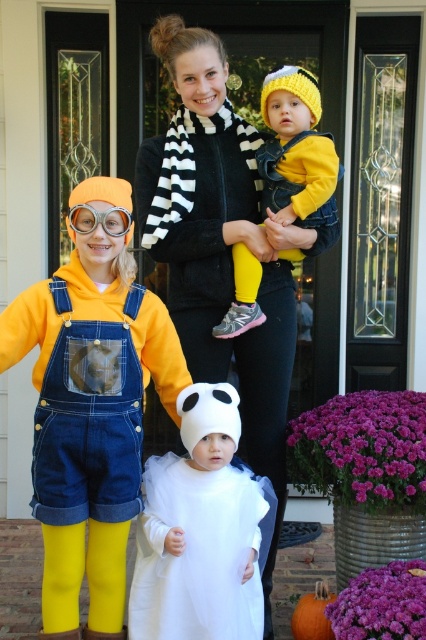
Can you confirm if white sheer dress at center is bigger than orange matte pumpkin at lower center?

Correct, white sheer dress at center is larger in size than orange matte pumpkin at lower center.

This screenshot has width=426, height=640. Describe the element at coordinates (199, 531) in the screenshot. I see `white sheer dress at center` at that location.

Where is `white sheer dress at center`? This screenshot has width=426, height=640. white sheer dress at center is located at coordinates (199, 531).

Who is positioned more to the left, yellow knit hat at center or clear plastic goggles at left?

Positioned to the left is clear plastic goggles at left.

Is yellow knit hat at center taller than clear plastic goggles at left?

Yes.

Where is `yellow knit hat at center`? This screenshot has width=426, height=640. yellow knit hat at center is located at coordinates (296, 152).

Locate an element on the screen. The image size is (426, 640). yellow knit hat at center is located at coordinates (296, 152).

Can you confirm if orange matte pumpkin at lower center is wider than clear plastic goggles at left?

No, orange matte pumpkin at lower center is not wider than clear plastic goggles at left.

Between orange matte pumpkin at lower center and clear plastic goggles at left, which one appears on the left side from the viewer's perspective?

Positioned to the left is clear plastic goggles at left.

The width and height of the screenshot is (426, 640). Identify the location of orange matte pumpkin at lower center. (313, 614).